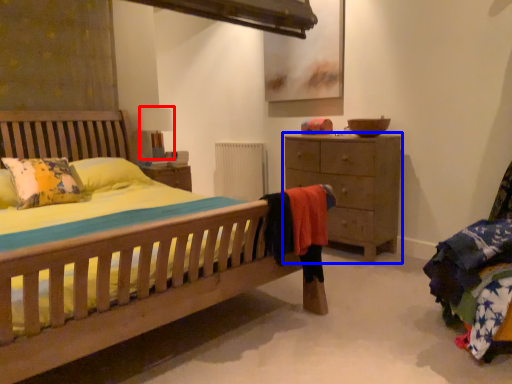
Question: Among these objects, which one is nearest to the camera, table lamp (highlighted by a red box) or chest of drawers (highlighted by a blue box)?

Choices:
 (A) table lamp
 (B) chest of drawers

Answer: (B)